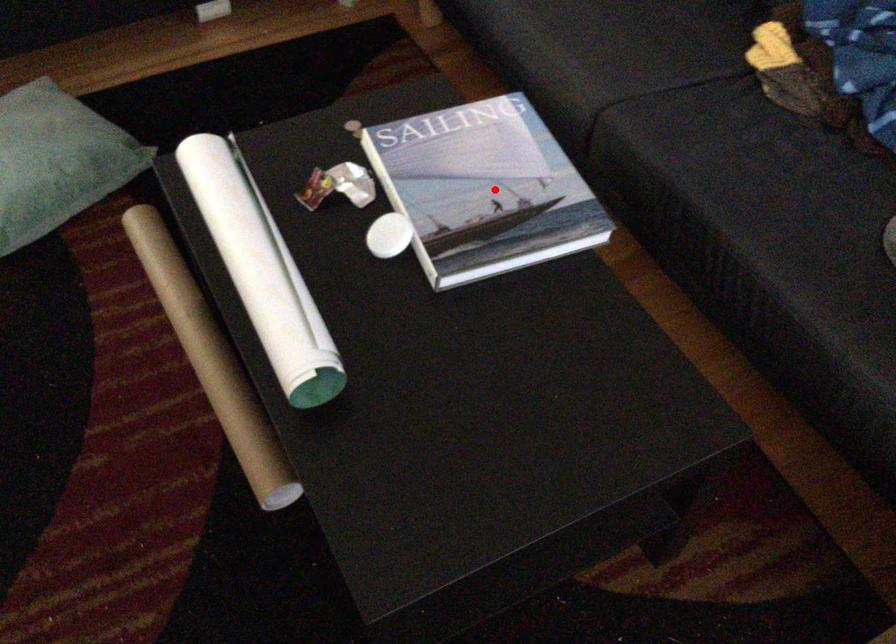
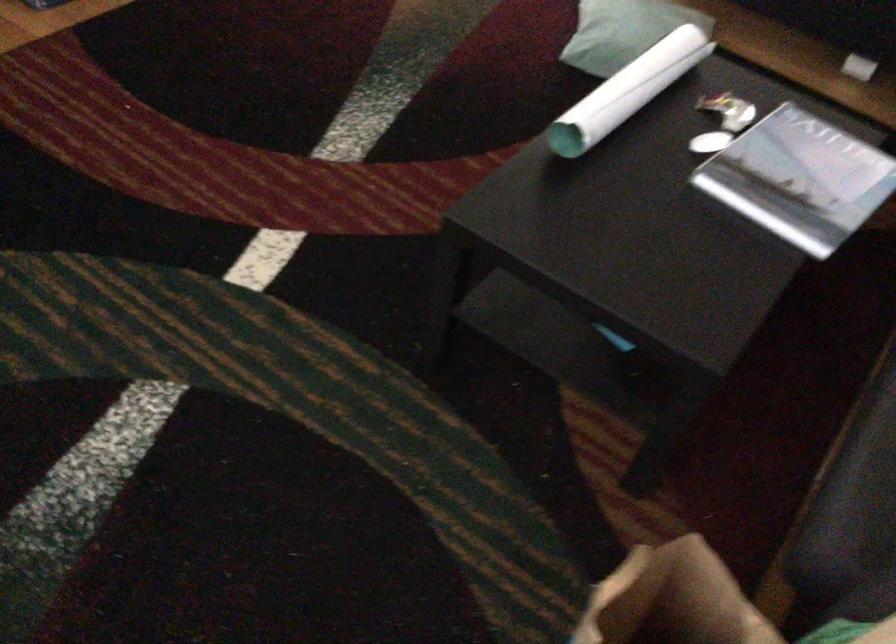
Find the pixel in the second image that matches the highlighted location in the first image.

(798, 178)